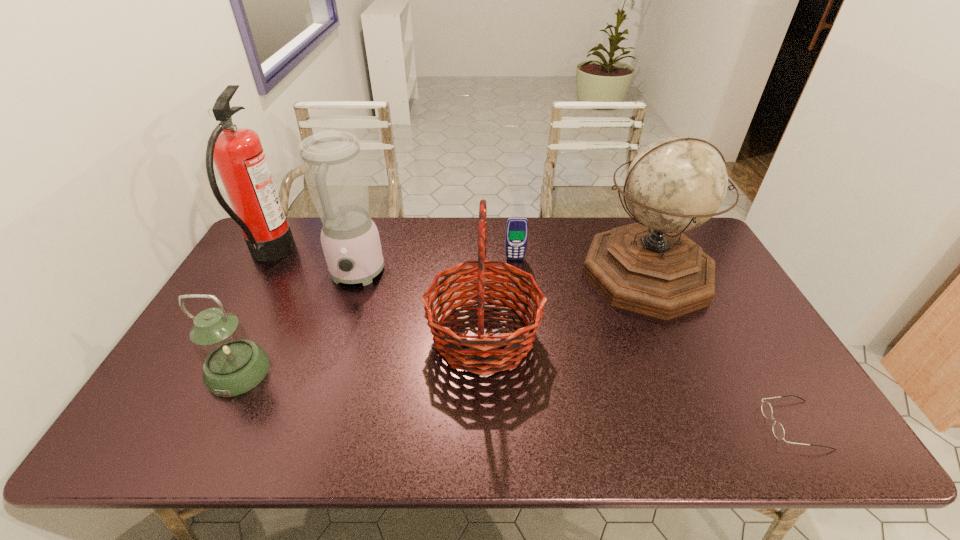
This screenshot has height=540, width=960. What are the coordinates of `free region at the left edge of the desktop` in the screenshot? It's located at (179, 414).

Identify the location of vacant area at the far left corner of the desktop. This screenshot has width=960, height=540. (301, 233).

Locate an element on the screen. This screenshot has height=540, width=960. vacant space at the near left corner of the desktop is located at coordinates (132, 442).

The image size is (960, 540). Identify the location of vacant space at the far right corner of the desktop. (702, 242).

Identify the location of vacant area that lies between the cellular telephone and the third shortest object. The width and height of the screenshot is (960, 540). (377, 315).

Locate an element on the screen. Image resolution: width=960 pixels, height=540 pixels. vacant area between the fire extinguisher and the cellular telephone is located at coordinates (393, 257).

This screenshot has height=540, width=960. Find the location of `vacant space that is in between the fire extinguisher and the lantern`. vacant space that is in between the fire extinguisher and the lantern is located at coordinates (254, 313).

You are a GUI agent. You are given a task and a screenshot of the screen. Output one action in this format:
    pyautogui.click(x=<x>, y=<y>)
    Task: Click on the free space that is in between the fire extinguisher and the food processor
    This screenshot has height=540, width=960.
    Given the screenshot: What is the action you would take?
    pyautogui.click(x=313, y=265)

Image resolution: width=960 pixels, height=540 pixels. In order to click on free space between the third shortest object and the basket in this screenshot , I will do `click(361, 354)`.

Find the location of a particular element. vacant area between the basket and the spectacles is located at coordinates (638, 381).